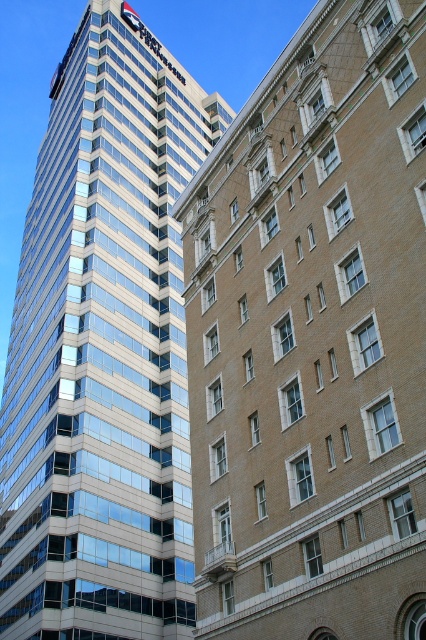
Is beige brick building at center positioned before glassy reflective skyscraper at center?

Yes, beige brick building at center is closer to the viewer.

Is point (316, 212) positioned in front of point (109, 154)?

Yes, it is in front of point (109, 154).

Find the location of a particular element. beige brick building at center is located at coordinates (313, 339).